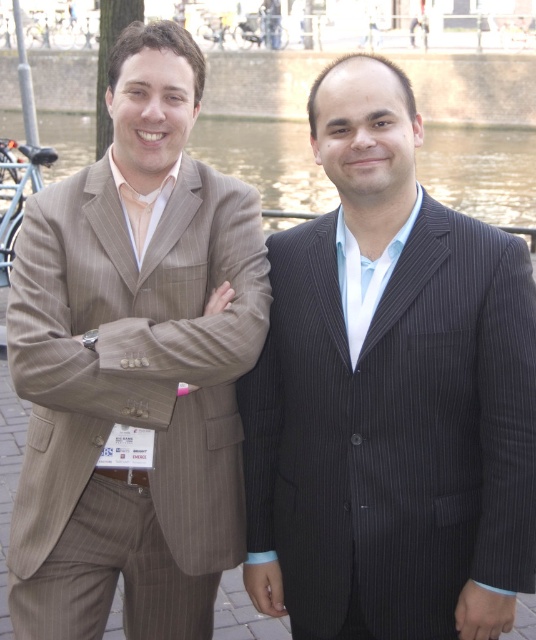
Question: Is dark pinstripe suit at center positioned at the back of transparent water at center?

Choices:
 (A) no
 (B) yes

Answer: (A)

Question: From the image, what is the correct spatial relationship of dark pinstripe suit at center in relation to transparent water at center?

Choices:
 (A) left
 (B) right

Answer: (B)

Question: Which object appears closest to the camera in this image?

Choices:
 (A) brown pinstripe suit at left
 (B) dark pinstripe suit at center

Answer: (B)

Question: Does brown pinstripe suit at left appear on the left side of transparent water at center?

Choices:
 (A) yes
 (B) no

Answer: (B)

Question: Which of the following is the closest to the observer?

Choices:
 (A) (517, 156)
 (B) (416, 349)

Answer: (B)

Question: Which point is farther to the camera?

Choices:
 (A) brown pinstripe suit at left
 (B) transparent water at center

Answer: (B)